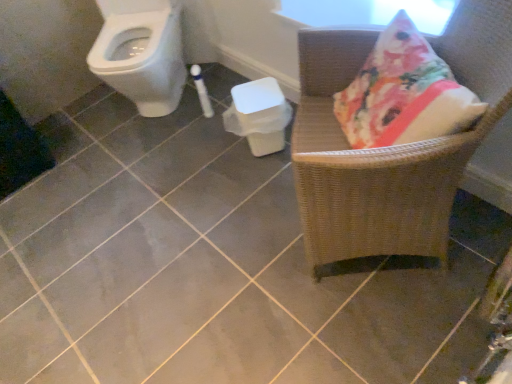
Where is `vacant region below white glossy toilet at upper left (from a real-world perspective)`? Image resolution: width=512 pixels, height=384 pixels. vacant region below white glossy toilet at upper left (from a real-world perspective) is located at coordinates (154, 117).